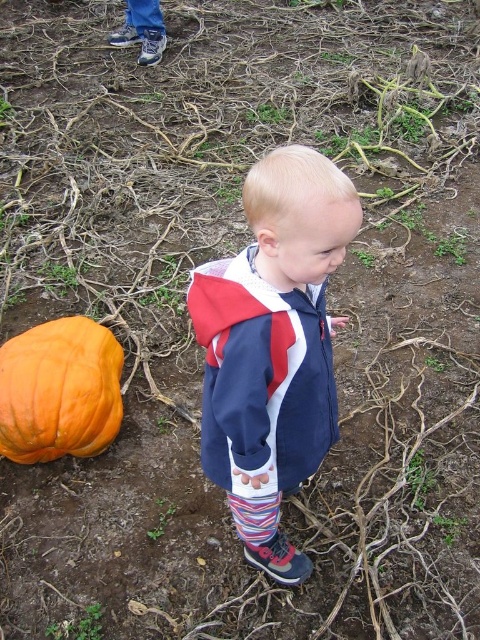
Question: Can you confirm if navy blue jacket at center is positioned to the right of orange matte pumpkin at lower left?

Choices:
 (A) yes
 (B) no

Answer: (A)

Question: Which object appears farthest from the camera in this image?

Choices:
 (A) navy blue jacket at center
 (B) orange matte pumpkin at lower left

Answer: (B)

Question: Among these objects, which one is farthest from the camera?

Choices:
 (A) orange matte pumpkin at lower left
 (B) navy blue jacket at center

Answer: (A)

Question: Which point is closer to the camera?

Choices:
 (A) (101, 333)
 (B) (340, 212)

Answer: (B)

Question: Considering the relative positions of navy blue jacket at center and orange matte pumpkin at lower left in the image provided, where is navy blue jacket at center located with respect to orange matte pumpkin at lower left?

Choices:
 (A) right
 (B) left

Answer: (A)

Question: Is navy blue jacket at center below orange matte pumpkin at lower left?

Choices:
 (A) yes
 (B) no

Answer: (B)